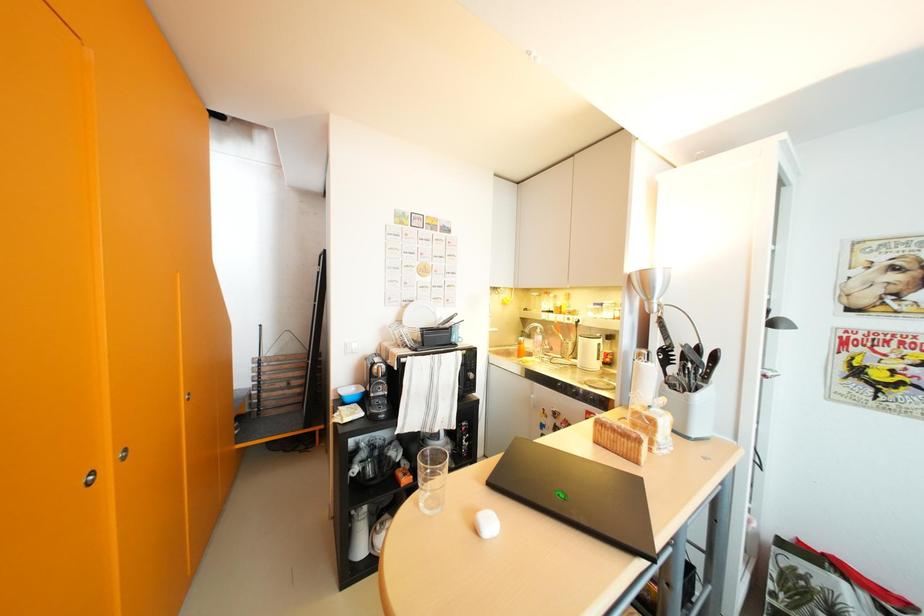
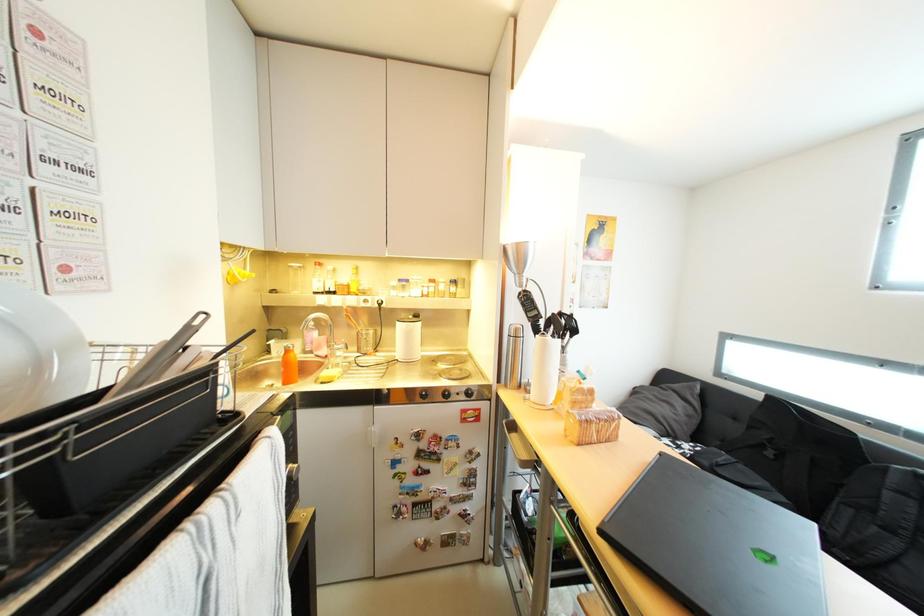
Question: The camera is either moving clockwise (left) or counter-clockwise (right) around the object. The first image is from the beginning of the video and the second image is from the end. Is the camera moving left or right when shooting the video?

Choices:
 (A) Left
 (B) Right

Answer: (A)